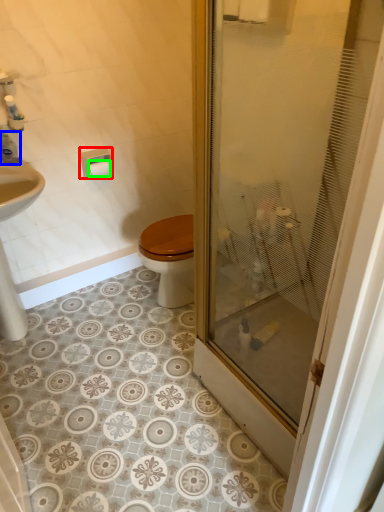
Question: Which is farther away from towel bar (highlighted by a red box)? toiletry (highlighted by a blue box) or toilet paper (highlighted by a green box)?

Choices:
 (A) toiletry
 (B) toilet paper

Answer: (A)